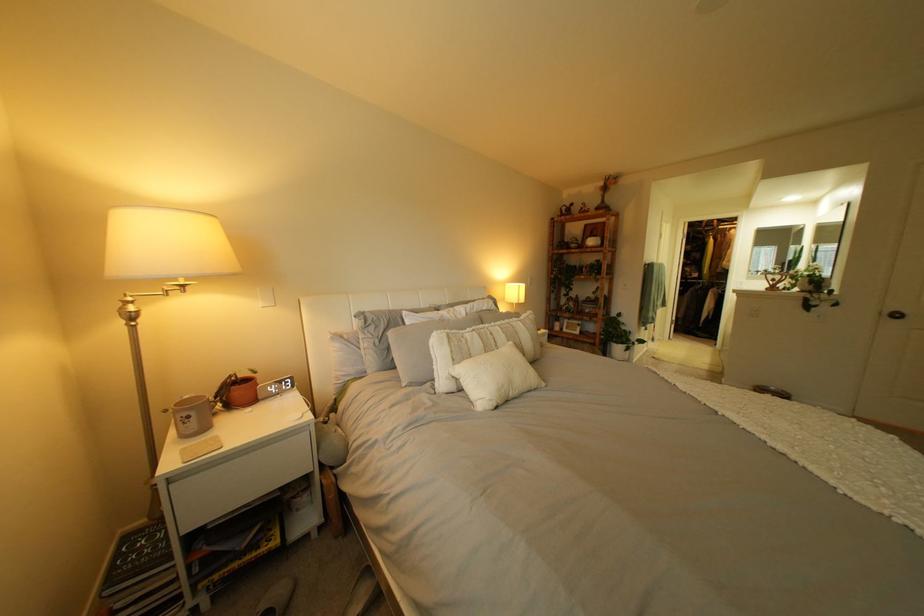
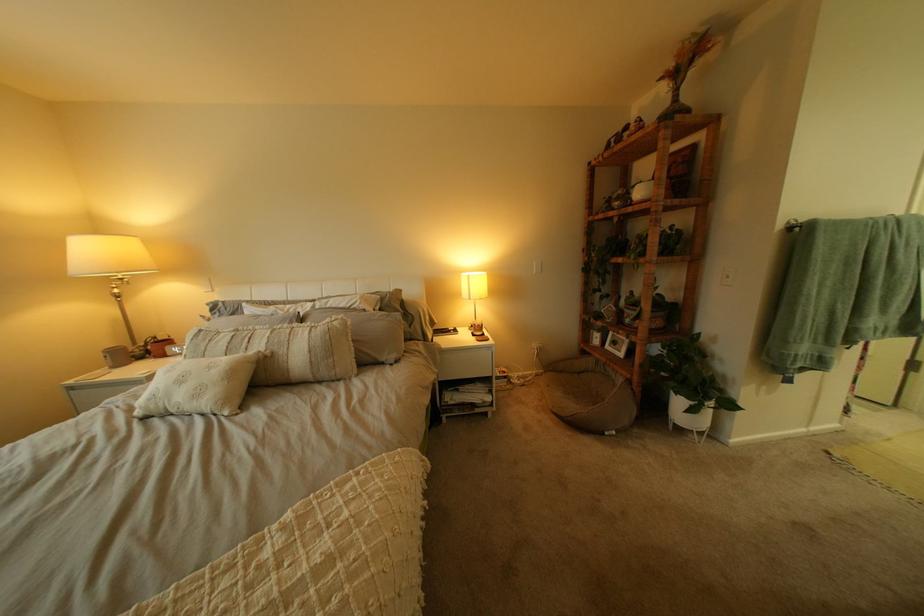
In the second image, find the point that corresponds to (x=518, y=337) in the first image.

(281, 342)